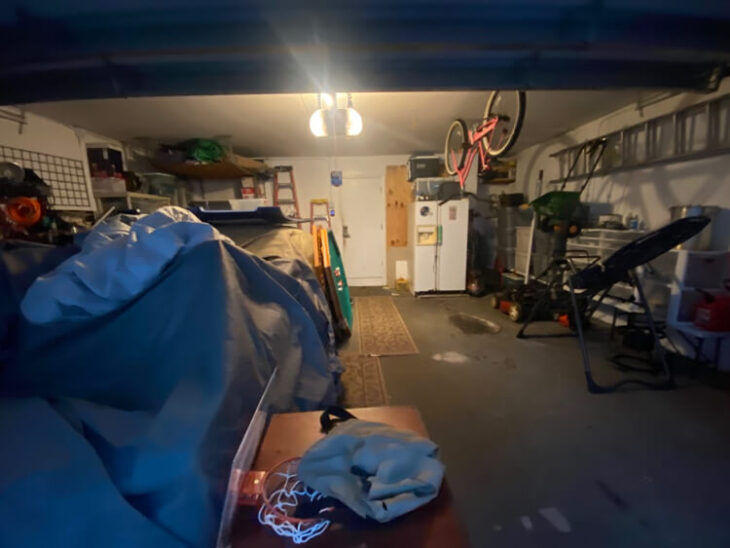
Find the location of `floor`. floor is located at coordinates (511, 411).